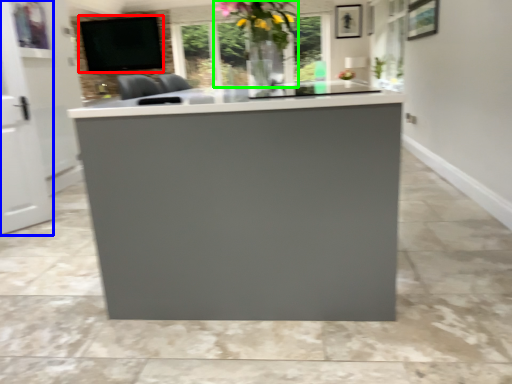
Question: Which object is the farthest from window screen (highlighted by a red box)? Choose among these: glass door (highlighted by a blue box) or floral arrangement (highlighted by a green box).

Choices:
 (A) glass door
 (B) floral arrangement

Answer: (A)